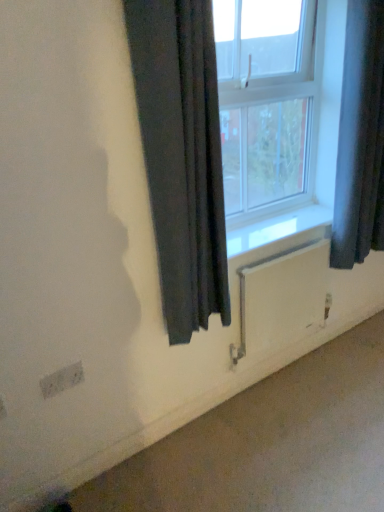
In order to click on free area below white matte radiator at lower center (from a real-world perspective) in this screenshot , I will do `click(271, 371)`.